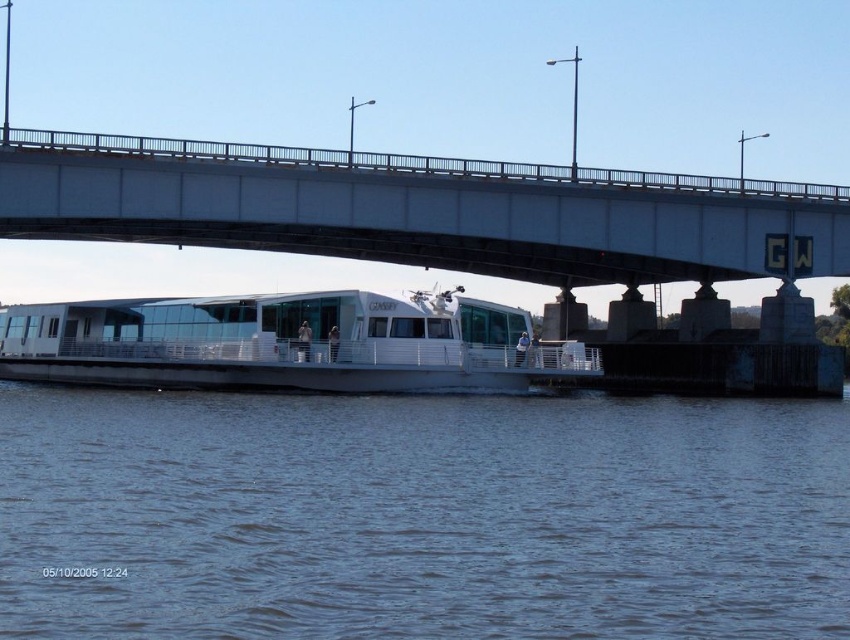
Is point (823, 627) more distant than point (282, 368)?

No, it is not.

What are the coordinates of `blue water at lower center` in the screenshot? It's located at (420, 516).

Does white concrete bridge at upper center have a greater width compared to white glossy boat at center?

Correct, the width of white concrete bridge at upper center exceeds that of white glossy boat at center.

Is white concrete bridge at upper center further to camera compared to white glossy boat at center?

Yes, white concrete bridge at upper center is further from the viewer.

Does point (777, 273) come behind point (552, 349)?

Yes, point (777, 273) is behind point (552, 349).

The image size is (850, 640). Find the location of `white concrete bridge at upper center`. white concrete bridge at upper center is located at coordinates (420, 209).

Does point (190, 488) come closer to viewer compared to point (718, 275)?

Yes, point (190, 488) is in front of point (718, 275).

Between point (842, 456) and point (579, 280), which one is positioned in front?

Positioned in front is point (842, 456).

Which is in front, point (111, 483) or point (250, 228)?

Point (111, 483)

Find the location of a particular element. The width and height of the screenshot is (850, 640). blue water at lower center is located at coordinates (420, 516).